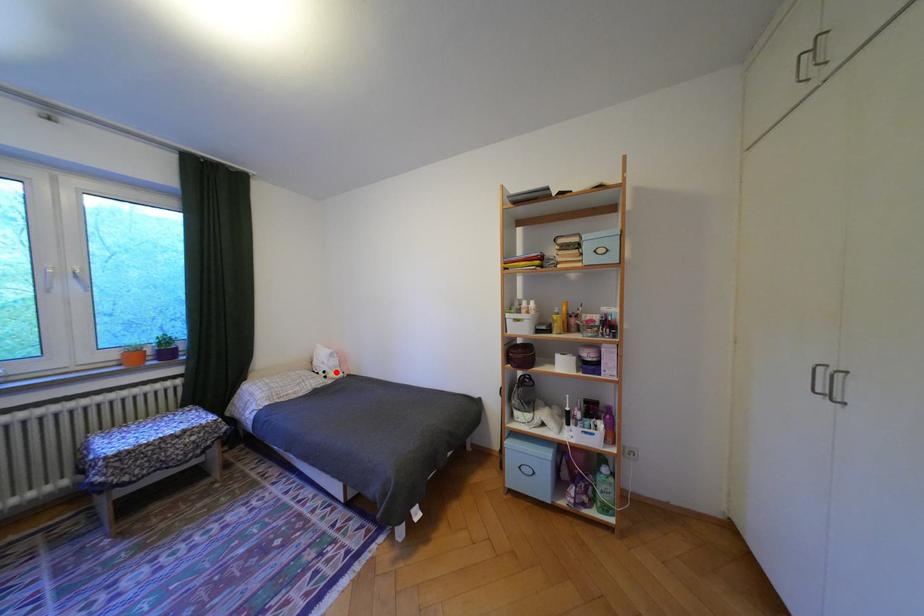
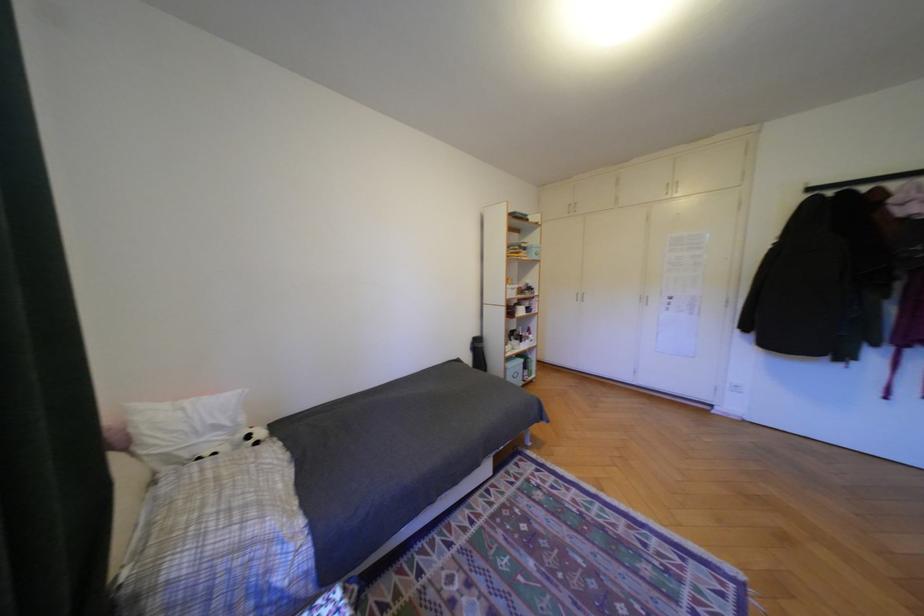
The point at the highlighted location is marked in the first image. Where is the corresponding point in the second image?

(261, 437)